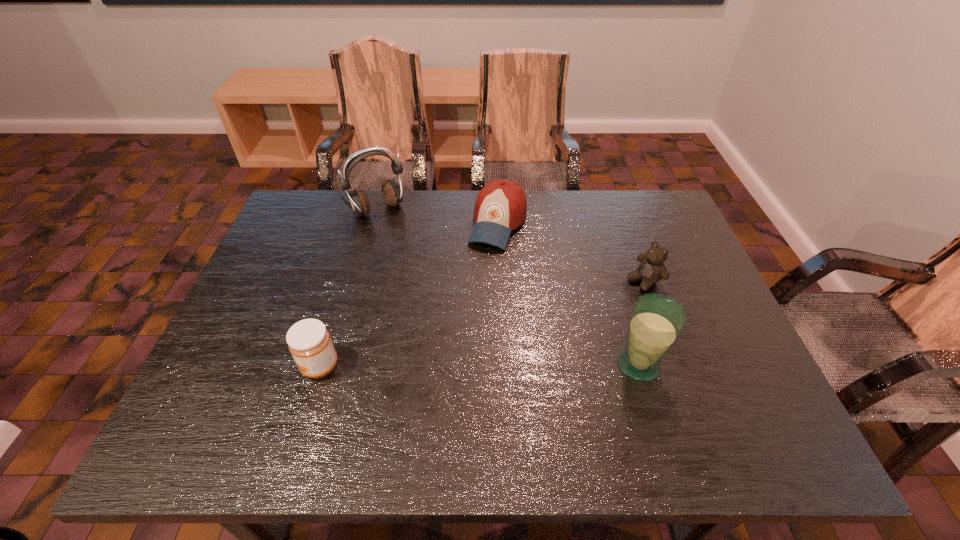
You are a GUI agent. You are given a task and a screenshot of the screen. Output one action in this format:
    pyautogui.click(x=<x>, y=<y>)
    Task: Click on the jam that is at the near edge
    This screenshot has width=960, height=540.
    Given the screenshot: What is the action you would take?
    pyautogui.click(x=309, y=342)

In order to click on glass at the near edge in this screenshot , I will do `click(656, 321)`.

I want to click on object located in the right edge section of the desktop, so click(x=652, y=269).

Locate an element on the screen. The width and height of the screenshot is (960, 540). vacant space at the far edge of the desktop is located at coordinates (518, 230).

You are a GUI agent. You are given a task and a screenshot of the screen. Output one action in this format:
    pyautogui.click(x=<x>, y=<y>)
    Task: Click on the vacant space at the near edge of the desktop
    The width and height of the screenshot is (960, 540).
    Given the screenshot: What is the action you would take?
    pyautogui.click(x=450, y=399)

Find the location of `vacant space at the right edge of the desktop`. vacant space at the right edge of the desktop is located at coordinates (682, 350).

Find the location of `blank space at the far left corner of the desktop`. blank space at the far left corner of the desktop is located at coordinates (303, 211).

You are a GUI agent. You are given a task and a screenshot of the screen. Output one action in this format:
    pyautogui.click(x=<x>, y=<y>)
    Task: Click on the free spot at the near left corner of the desktop
    This screenshot has height=540, width=960.
    Given the screenshot: What is the action you would take?
    pyautogui.click(x=241, y=386)

You are a GUI agent. You are given a task and a screenshot of the screen. Output one action in this format:
    pyautogui.click(x=<x>, y=<y>)
    Task: Click on the free space at the far right corner of the desktop
    
    Given the screenshot: What is the action you would take?
    pyautogui.click(x=635, y=230)

Locate an element on the screen. free area in between the third object from left to right and the jam is located at coordinates (409, 294).